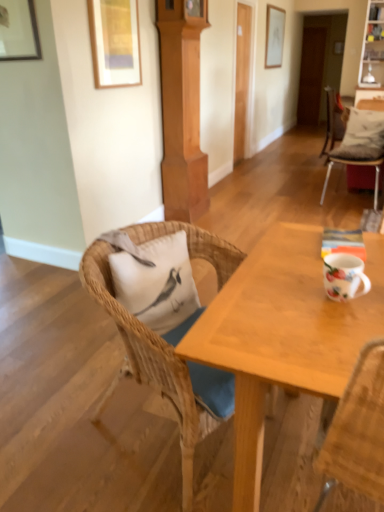
I want to click on vacant space that is to the left of woven wood chair at center, which is the 1th chair in left-to-right order, so click(64, 418).